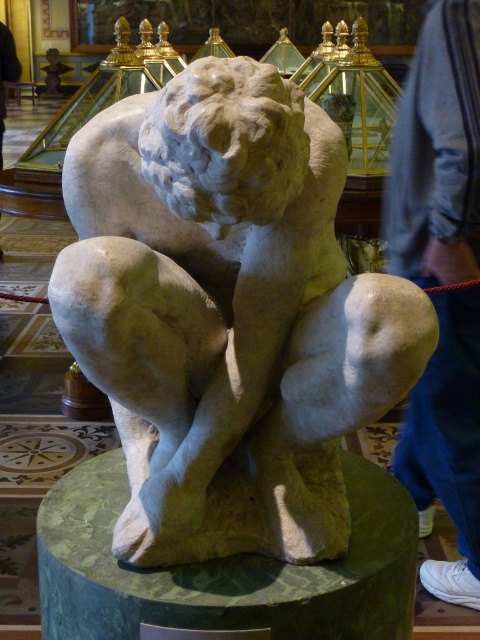
You are a security guard in the museum and notice the white marble lion at center and the blue jeans at lower right. Which object is wider?

The white marble lion at center is wider than the blue jeans at lower right.

You are a museum visitor standing in front of the white marble lion at center. Can you see the green marble pedestal at center behind the lion?

The white marble lion at center is in front of the green marble pedestal at center, so yes, the green marble pedestal at center is behind the lion and should be visible from your vantage point.

Consider the image. You are a security guard in a museum and you see the green marble pedestal at center and the blue jeans at lower right. Which object is closer to the entrance of the museum?

The blue jeans at lower right are closer to the entrance because the green marble pedestal at center is positioned under it, indicating the pedestal is behind the jeans.